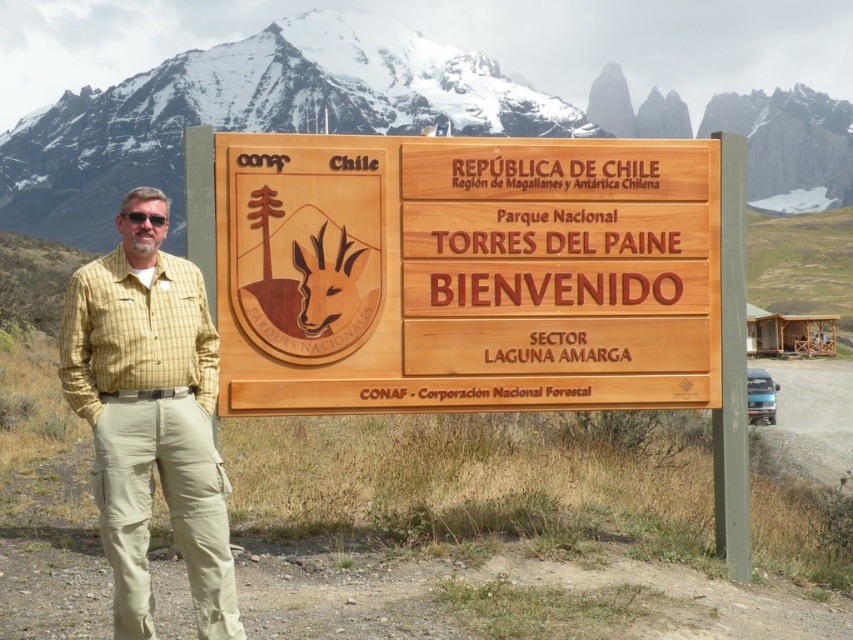
Question: Is wooden sign at center further to the viewer compared to snowy white mountain at upper center?

Choices:
 (A) yes
 (B) no

Answer: (B)

Question: Which point is farther to the camera?

Choices:
 (A) (177, 380)
 (B) (253, 344)

Answer: (B)

Question: Does wooden sign at center appear under yellow plaid shirt at left?

Choices:
 (A) no
 (B) yes

Answer: (A)

Question: Which point is farther to the camera?

Choices:
 (A) (630, 323)
 (B) (160, 243)
 (C) (183, 81)

Answer: (C)

Question: Can you confirm if wooden sign at center is positioned above yellow plaid shirt at left?

Choices:
 (A) no
 (B) yes

Answer: (B)

Question: Estimate the real-world distances between objects in this image. Which object is farther from the yellow plaid shirt at left?

Choices:
 (A) wooden sign at center
 (B) snowy white mountain at upper center

Answer: (B)